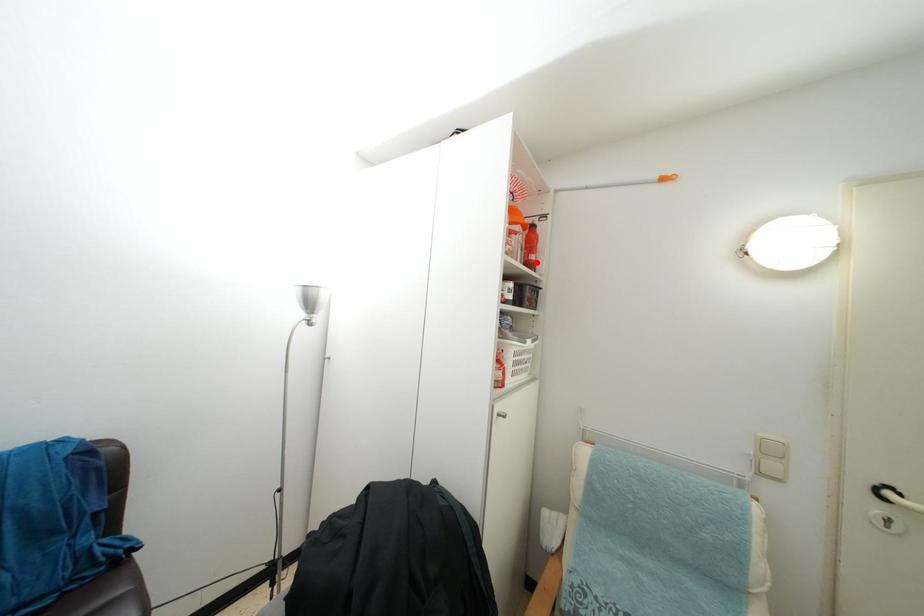
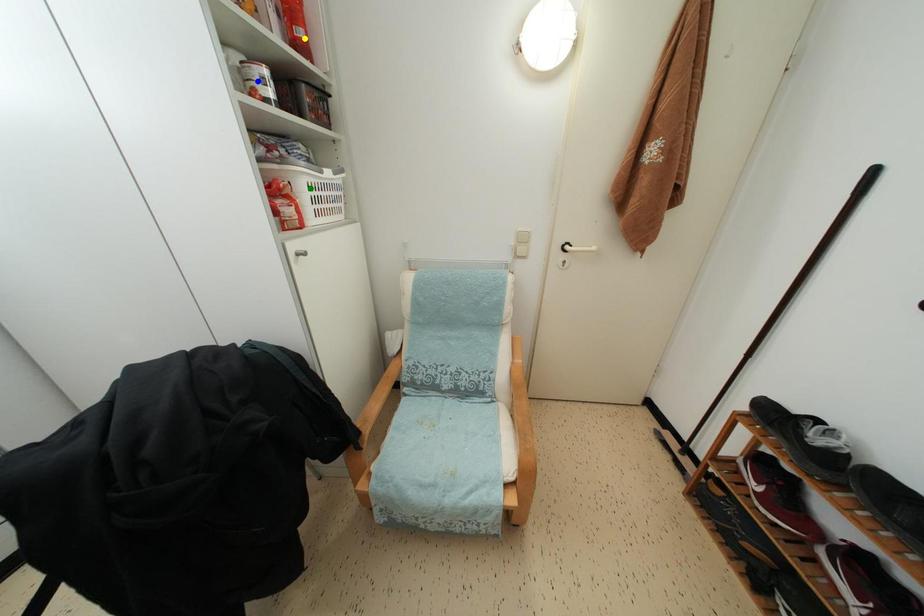
Question: I am providing you with two images of the same scene from different viewpoints. A red point is marked on the first image. You are given multiple points on the second image. Which point in image 2 represents the same 3d spot as the red point in image 1?

Choices:
 (A) green point
 (B) blue point
 (C) yellow point

Answer: (C)